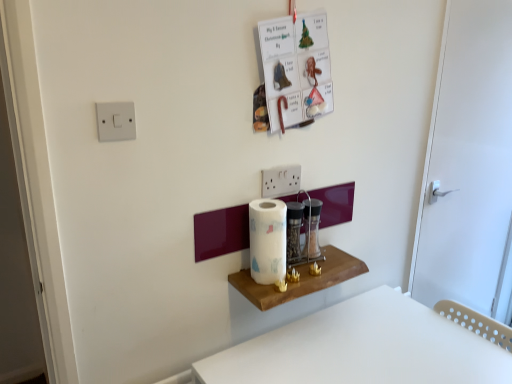
Question: Is the depth of white plastic light switch at upper left less than that of white plastic table at lower right?

Choices:
 (A) no
 (B) yes

Answer: (A)

Question: Is white plastic table at lower right surrounded by white plastic light switch at upper left?

Choices:
 (A) yes
 (B) no

Answer: (B)

Question: From the image's perspective, is white plastic light switch at upper left beneath white plastic table at lower right?

Choices:
 (A) yes
 (B) no

Answer: (B)

Question: Considering the relative sizes of white plastic light switch at upper left and white plastic table at lower right in the image provided, is white plastic light switch at upper left shorter than white plastic table at lower right?

Choices:
 (A) no
 (B) yes

Answer: (B)

Question: Considering the relative positions of white plastic light switch at upper left and white plastic table at lower right in the image provided, is white plastic light switch at upper left to the right of white plastic table at lower right from the viewer's perspective?

Choices:
 (A) no
 (B) yes

Answer: (A)

Question: Considering the relative sizes of white plastic light switch at upper left and white plastic table at lower right in the image provided, is white plastic light switch at upper left taller than white plastic table at lower right?

Choices:
 (A) yes
 (B) no

Answer: (B)

Question: Does white plastic light switch at upper left appear on the right side of white glossy paper towel at center?

Choices:
 (A) no
 (B) yes

Answer: (A)

Question: From the image's perspective, does white plastic light switch at upper left appear higher than white glossy paper towel at center?

Choices:
 (A) yes
 (B) no

Answer: (A)

Question: Is white plastic light switch at upper left located outside white glossy paper towel at center?

Choices:
 (A) yes
 (B) no

Answer: (A)

Question: Considering the relative positions of white plastic light switch at upper left and white glossy paper towel at center in the image provided, is white plastic light switch at upper left to the left of white glossy paper towel at center from the viewer's perspective?

Choices:
 (A) yes
 (B) no

Answer: (A)

Question: Can you confirm if white plastic light switch at upper left is taller than white glossy paper towel at center?

Choices:
 (A) no
 (B) yes

Answer: (A)

Question: Does white plastic light switch at upper left have a smaller size compared to white glossy paper towel at center?

Choices:
 (A) no
 (B) yes

Answer: (B)

Question: Considering the relative positions of white plastic table at lower right and wooden shelf at center in the image provided, is white plastic table at lower right behind wooden shelf at center?

Choices:
 (A) yes
 (B) no

Answer: (B)